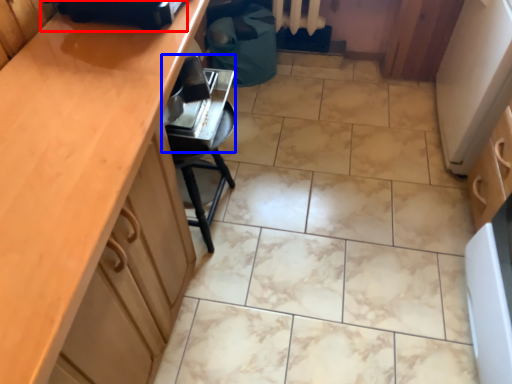
Question: Which point is further to the camera, appliance (highlighted by a red box) or appliance (highlighted by a blue box)?

Choices:
 (A) appliance
 (B) appliance

Answer: (B)